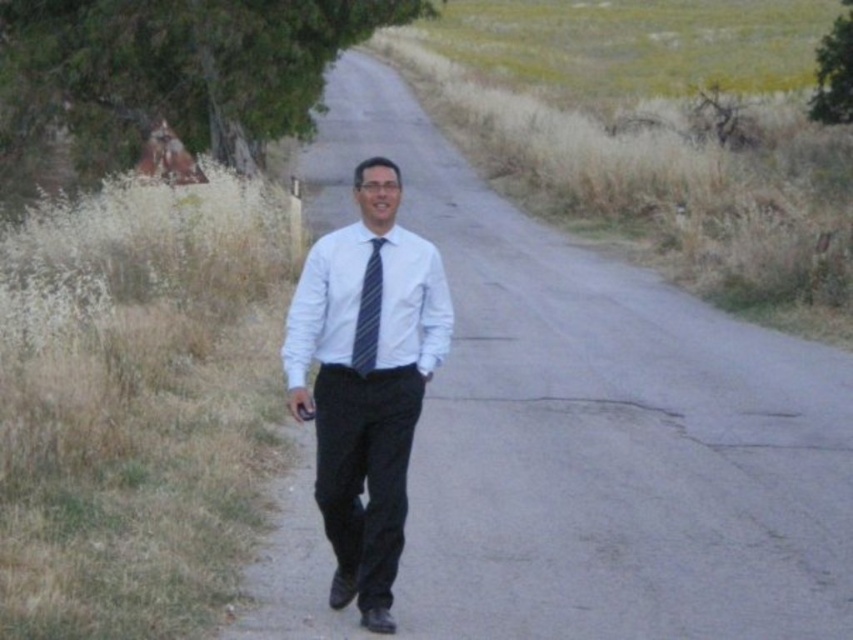
You are a photographer trying to capture the person in the white striped shirt at center. The camera you are using has a limited field of view. What is the exact coordinate where you should aim your camera to ensure the person is centered in the frame?

The white striped shirt at center is located at coordinate point (326, 301), so you should aim your camera at that exact coordinate to center the person in the frame.

You are a hiker who wants to take a shortcut to the green leafy tree at upper right. You see the matte asphalt road at center. Which direction should you go relative to the road to reach the tree?

The matte asphalt road at center is positioned on the left side of the green leafy tree at upper right, so to reach the tree, you should go to the right side of the road.

You are a photographer trying to capture the person in the blue striped tie at center without the green leafy tree at upper left blocking the view. Can you adjust your position to do so?

The blue striped tie at center is behind the green leafy tree at upper left, so moving your position to the right or left might allow you to frame the shot without the tree obstructing the view.